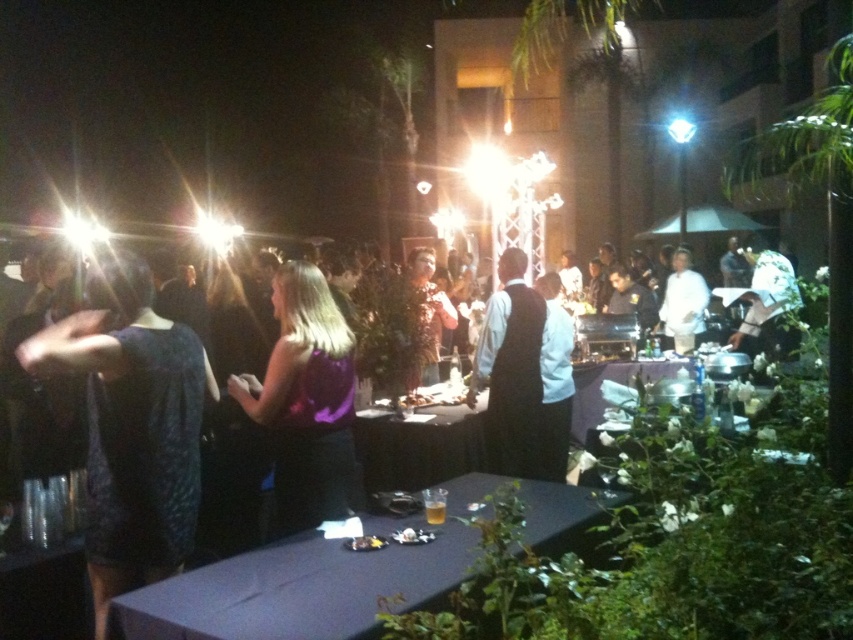
Question: Does matte black table at lower center have a greater width compared to white chef coat at center?

Choices:
 (A) no
 (B) yes

Answer: (B)

Question: Where is white fabric hat at upper right located in relation to white chef coat at center in the image?

Choices:
 (A) left
 (B) right

Answer: (B)

Question: Which of the following is the farthest from the observer?

Choices:
 (A) purple fabric table at center
 (B) white chef coat at center

Answer: (B)

Question: Among these objects, which one is farthest from the camera?

Choices:
 (A) white chef coat at center
 (B) white fabric hat at upper right
 (C) black satin vest at center

Answer: (A)

Question: From the image, what is the correct spatial relationship of dark textured dress at left in relation to white chef coat at center?

Choices:
 (A) above
 (B) below

Answer: (B)

Question: Which point is closer to the camera?

Choices:
 (A) (525, 406)
 (B) (137, 262)
 (C) (778, 275)
 (D) (434, 346)

Answer: (B)